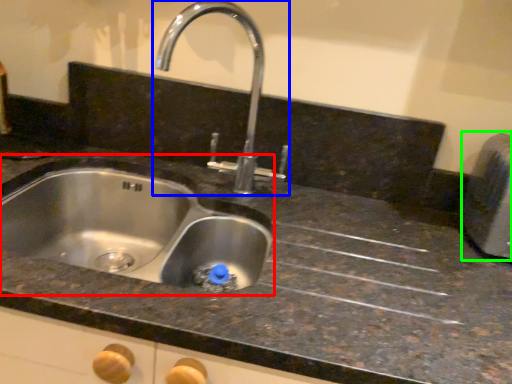
Question: Which object is the closest to the sink (highlighted by a red box)? Choose among these: tap (highlighted by a blue box) or appliance (highlighted by a green box).

Choices:
 (A) tap
 (B) appliance

Answer: (A)